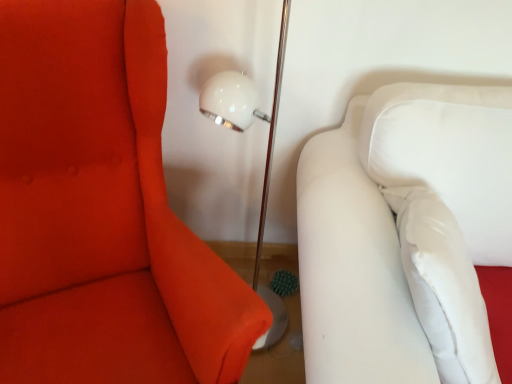
Question: In terms of height, does matte white sofa at right, positioned as the first furniture in left-to-right order, look taller or shorter compared to white fabric couch at right, marked as the second furniture in a left-to-right arrangement?

Choices:
 (A) tall
 (B) short

Answer: (A)

Question: From the image's perspective, is matte white sofa at right, positioned as the first furniture in left-to-right order, above or below white fabric couch at right, the first furniture viewed from the right?

Choices:
 (A) above
 (B) below

Answer: (A)

Question: From a real-world perspective, is matte white sofa at right, positioned as the first furniture in left-to-right order, above or below white fabric couch at right, marked as the second furniture in a left-to-right arrangement?

Choices:
 (A) above
 (B) below

Answer: (A)

Question: Looking at their shapes, would you say white fabric couch at right, marked as the second furniture in a left-to-right arrangement, is wider or thinner than matte white sofa at right, arranged as the second furniture when viewed from the right?

Choices:
 (A) thin
 (B) wide

Answer: (A)

Question: Which is correct: white fabric couch at right, marked as the second furniture in a left-to-right arrangement, is inside matte white sofa at right, positioned as the first furniture in left-to-right order, or outside of it?

Choices:
 (A) inside
 (B) outside

Answer: (B)

Question: Considering the positions of white fabric couch at right, the first furniture viewed from the right, and matte white sofa at right, positioned as the first furniture in left-to-right order, in the image, is white fabric couch at right, the first furniture viewed from the right, taller or shorter than matte white sofa at right, positioned as the first furniture in left-to-right order,?

Choices:
 (A) tall
 (B) short

Answer: (B)

Question: In the image, is white fabric couch at right, the first furniture viewed from the right, on the left side or the right side of matte white sofa at right, arranged as the second furniture when viewed from the right?

Choices:
 (A) left
 (B) right

Answer: (B)